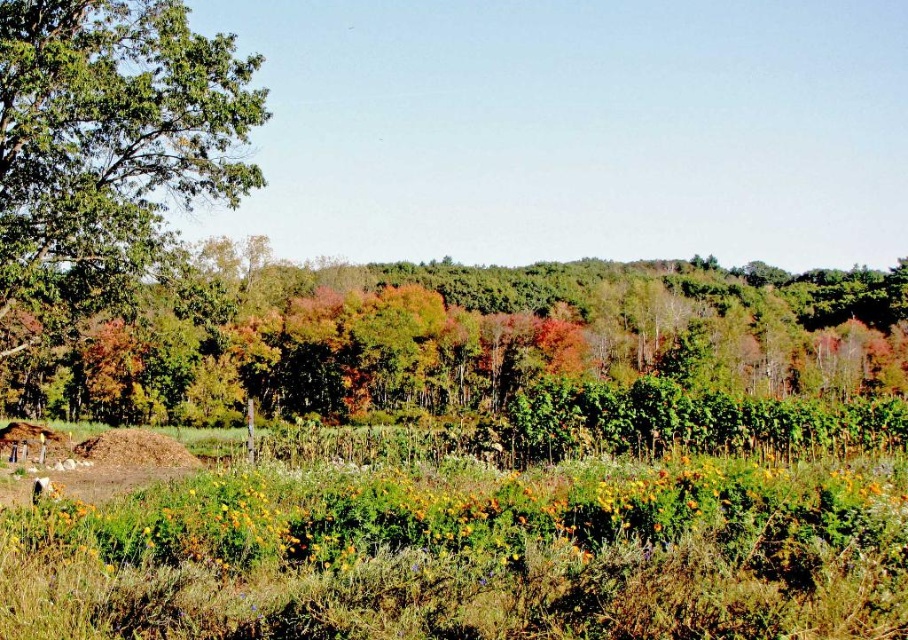
Does green grass at lower center have a lesser width compared to green leafy tree at upper left?

Correct, green grass at lower center's width is less than green leafy tree at upper left's.

Who is shorter, green grass at lower center or green leafy tree at upper left?

green grass at lower center is shorter.

Is point (637, 602) positioned before point (235, 81)?

Yes, it is.

In order to click on green grass at lower center in this screenshot , I will do `click(470, 556)`.

Consider the image. Can you confirm if green leafy tree at center is smaller than green leafy tree at upper left?

No, green leafy tree at center is not smaller than green leafy tree at upper left.

Can you confirm if green leafy tree at center is taller than green leafy tree at upper left?

Yes.

Where is `green leafy tree at center`? The height and width of the screenshot is (640, 908). green leafy tree at center is located at coordinates (454, 342).

Does point (368, 502) come behind point (239, 397)?

No, (368, 502) is closer to viewer.

Does green grass at lower center appear on the left side of green leafy tree at center?

Indeed, green grass at lower center is positioned on the left side of green leafy tree at center.

The width and height of the screenshot is (908, 640). Identify the location of green grass at lower center. (470, 556).

Where is `green grass at lower center`? green grass at lower center is located at coordinates (470, 556).